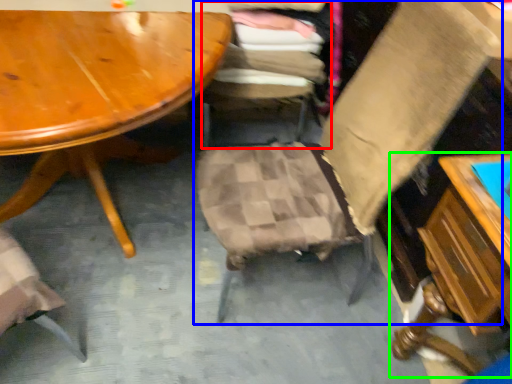
Question: Which is nearer to the chair (highlighted by a red box)? chair (highlighted by a blue box) or table (highlighted by a green box).

Choices:
 (A) chair
 (B) table

Answer: (A)